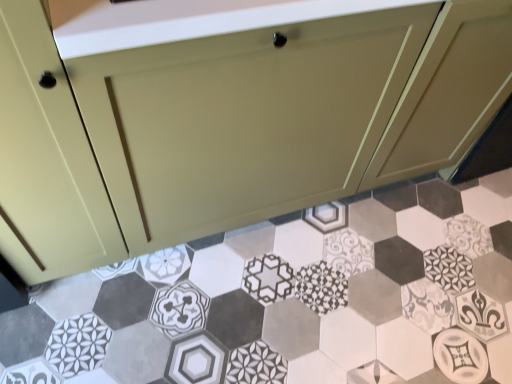
Question: Does point (x=296, y=309) appear closer or farther from the camera than point (x=329, y=188)?

Choices:
 (A) closer
 (B) farther

Answer: (A)

Question: Looking at their shapes, would you say patterned ceramic hexagon at center is wider or thinner than matte cream cabinet at center?

Choices:
 (A) thin
 (B) wide

Answer: (B)

Question: Would you say patterned ceramic hexagon at center is to the left or to the right of matte cream cabinet at center in the picture?

Choices:
 (A) right
 (B) left

Answer: (A)

Question: In terms of width, does matte cream cabinet at center look wider or thinner when compared to patterned ceramic hexagon at center?

Choices:
 (A) wide
 (B) thin

Answer: (B)

Question: In terms of size, does matte cream cabinet at center appear bigger or smaller than patterned ceramic hexagon at center?

Choices:
 (A) big
 (B) small

Answer: (A)

Question: From the image's perspective, relative to patterned ceramic hexagon at center, is matte cream cabinet at center above or below?

Choices:
 (A) below
 (B) above

Answer: (B)

Question: From a real-world perspective, relative to patterned ceramic hexagon at center, is matte cream cabinet at center vertically above or below?

Choices:
 (A) below
 (B) above

Answer: (B)